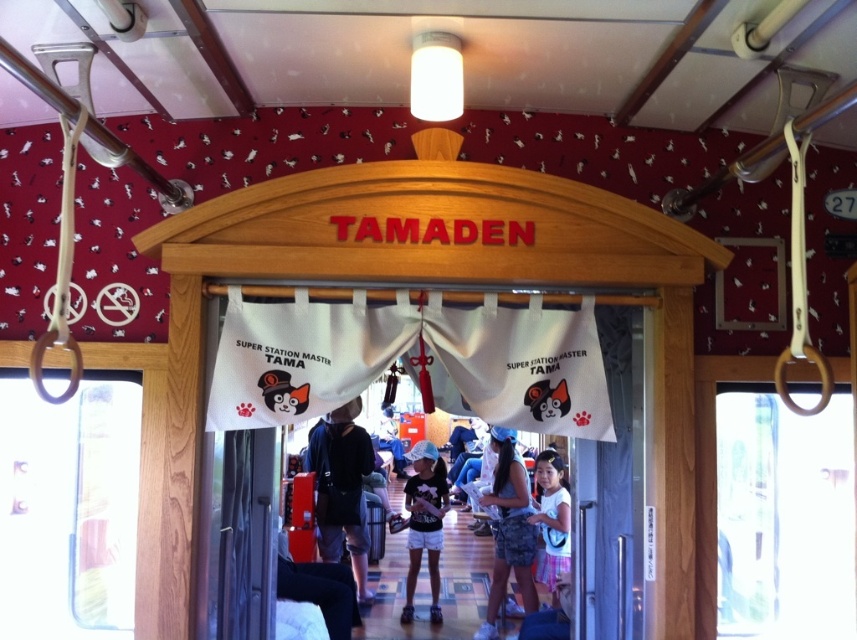
Question: Is camouflage shorts at center in front of white cotton shorts at center?

Choices:
 (A) no
 (B) yes

Answer: (B)

Question: Which object is the closest to the black fabric bag at center?

Choices:
 (A) white cotton shorts at center
 (B) camouflage shorts at center
 (C) white fabric banner at center
 (D) white cotton dress at lower right

Answer: (A)

Question: Does white fabric banner at center have a larger size compared to white cotton shorts at center?

Choices:
 (A) yes
 (B) no

Answer: (A)

Question: Which point is farther to the camera?

Choices:
 (A) (518, 467)
 (B) (544, 532)

Answer: (A)

Question: Is white fabric banner at center behind white cotton dress at lower right?

Choices:
 (A) no
 (B) yes

Answer: (A)

Question: Estimate the real-world distances between objects in this image. Which object is closer to the white cotton shorts at center?

Choices:
 (A) white fabric banner at center
 (B) black fabric bag at center
 (C) white cotton dress at lower right
 (D) camouflage shorts at center

Answer: (B)